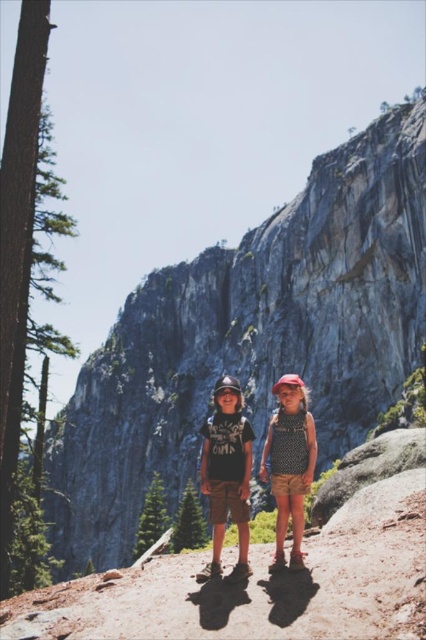
Can you confirm if gray rock formation at center is positioned to the right of green matte pine at center?

Yes, gray rock formation at center is to the right of green matte pine at center.

Which is in front, point (131, 480) or point (138, 557)?

Point (138, 557) is more forward.

The image size is (426, 640). Find the location of `gray rock formation at center`. gray rock formation at center is located at coordinates (250, 339).

Can you confirm if gray rock formation at center is bigger than dotted fabric dress at center?

Yes, gray rock formation at center is bigger than dotted fabric dress at center.

Which is in front, point (405, 332) or point (293, 472)?

Point (293, 472)

Find the location of `gray rock formation at center`. gray rock formation at center is located at coordinates (250, 339).

Between matte black helmet at center and green matte pine at center, which one has less height?

With less height is green matte pine at center.

The height and width of the screenshot is (640, 426). Find the location of `matte black helmet at center`. matte black helmet at center is located at coordinates (227, 472).

Measure the distance between point (x=215, y=401) and camera.

They are 60.99 meters apart.

This screenshot has width=426, height=640. Identify the location of matte black helmet at center. (227, 472).